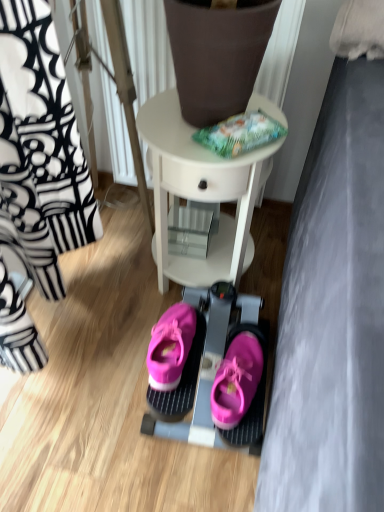
This screenshot has height=512, width=384. Identify the location of vacant space to the left of pink fabric sneakers at center. (93, 384).